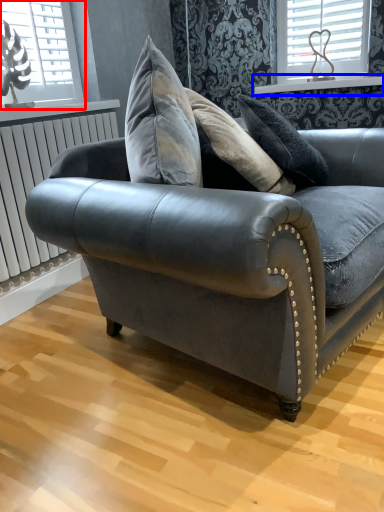
Question: Which point is closer to the camera, window (highlighted by a red box) or window sill (highlighted by a blue box)?

Choices:
 (A) window
 (B) window sill

Answer: (A)